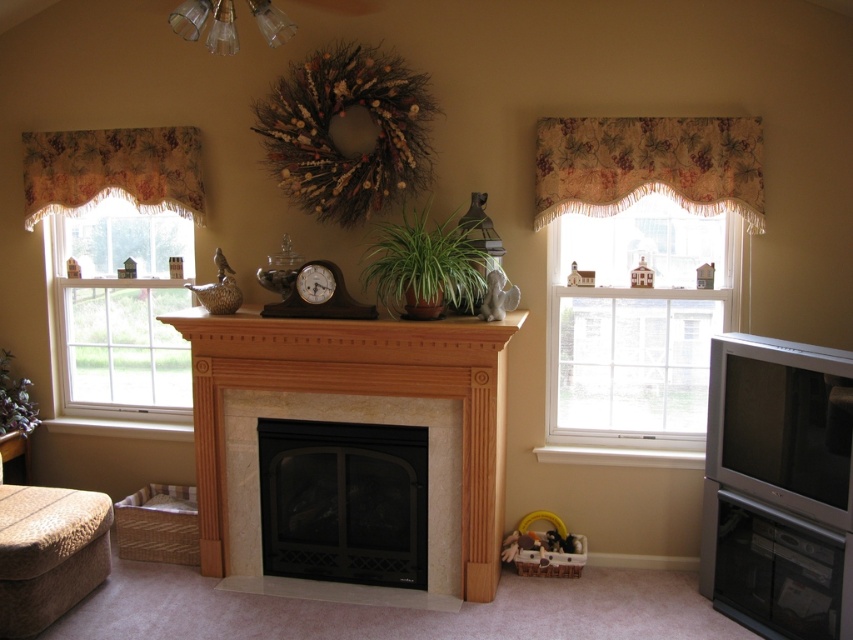
Question: From the image, what is the correct spatial relationship of brown fabric ottoman at lower left in relation to purple matte plant at lower left?

Choices:
 (A) left
 (B) right

Answer: (B)

Question: Which of the following is the farthest from the observer?

Choices:
 (A) brown fabric ottoman at lower left
 (B) floral fabric valance at upper right

Answer: (B)

Question: Which point is closer to the camera?

Choices:
 (A) (418, 282)
 (B) (57, 588)
 (C) (22, 392)

Answer: (B)

Question: Does clear glass window at left have a larger size compared to floral fabric valance at upper right?

Choices:
 (A) no
 (B) yes

Answer: (B)

Question: Is the position of black metal fireplace at center less distant than that of floral fabric valance at left?

Choices:
 (A) no
 (B) yes

Answer: (B)

Question: Which of the following is the farthest from the observer?

Choices:
 (A) black metal fireplace at center
 (B) floral fabric valance at upper right
 (C) green matte plant at center
 (D) floral fabric valance at left

Answer: (D)